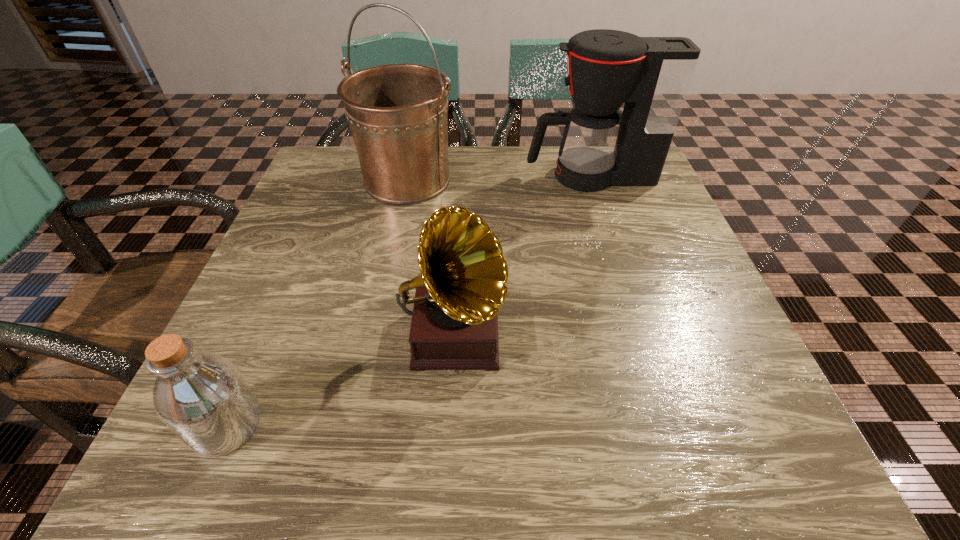
Identify the location of bucket. (397, 113).

In order to click on the third shortest object in this screenshot , I will do `click(652, 75)`.

Locate an element on the screen. The height and width of the screenshot is (540, 960). coffee maker is located at coordinates (652, 75).

Locate an element on the screen. Image resolution: width=960 pixels, height=540 pixels. phonograph record is located at coordinates (462, 284).

You are a GUI agent. You are given a task and a screenshot of the screen. Output one action in this format:
    pyautogui.click(x=<x>, y=<y>)
    Task: Click on the leftmost object
    
    Given the screenshot: What is the action you would take?
    pyautogui.click(x=202, y=397)

Locate an element on the screen. Image resolution: width=960 pixels, height=540 pixels. the shortest object is located at coordinates (202, 397).

The image size is (960, 540). I want to click on free space located on the right of the bucket, so click(x=520, y=180).

Where is `free location located 0.050m pour from the carafe of the third shortest object`? The image size is (960, 540). free location located 0.050m pour from the carafe of the third shortest object is located at coordinates (505, 177).

Locate an element on the screen. vacant space situated 0.160m pour from the carafe of the third shortest object is located at coordinates (459, 177).

What are the coordinates of `free space located 0.220m pour from the carafe of the third shortest object` in the screenshot? It's located at (434, 177).